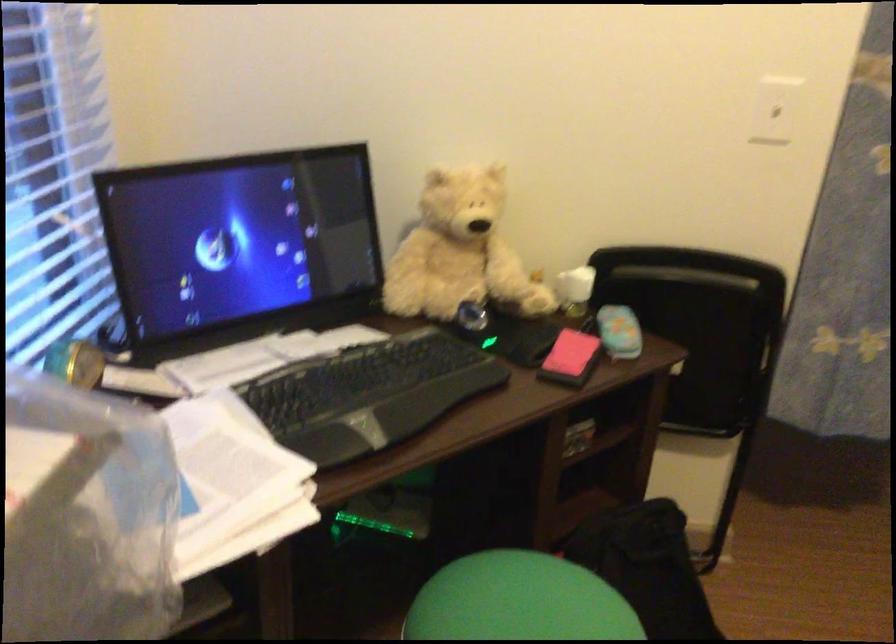
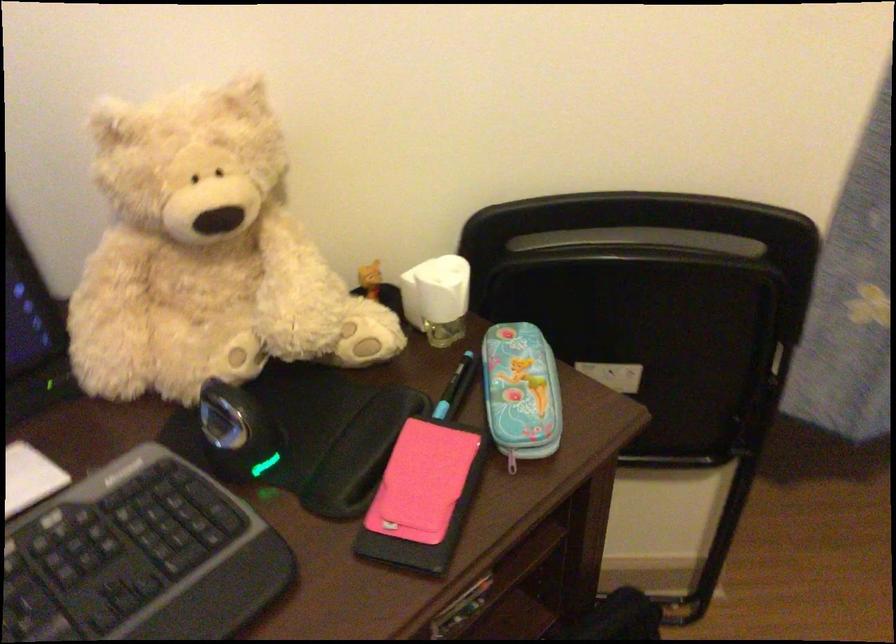
Locate, in the second image, the point that corresponds to pixel 616 355 in the first image.

(512, 460)